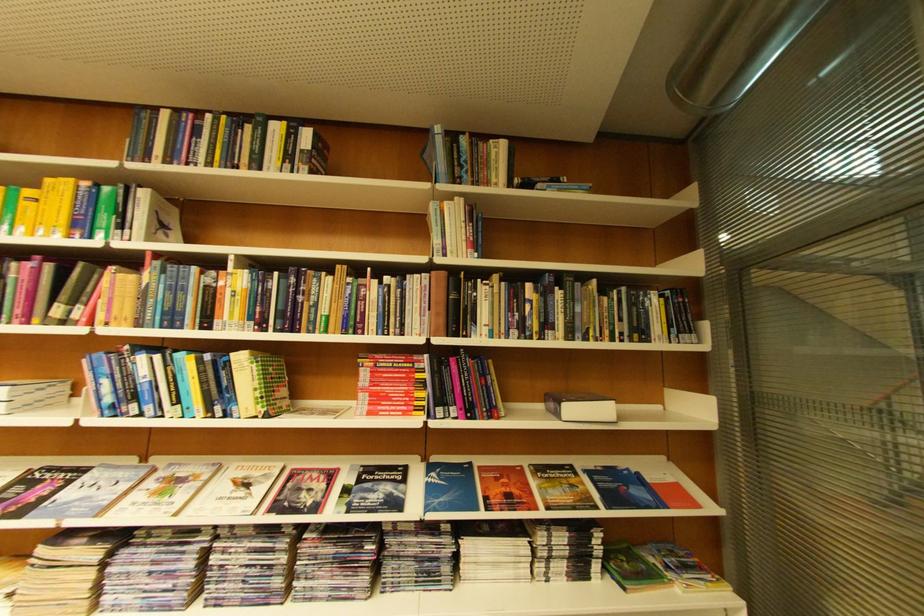
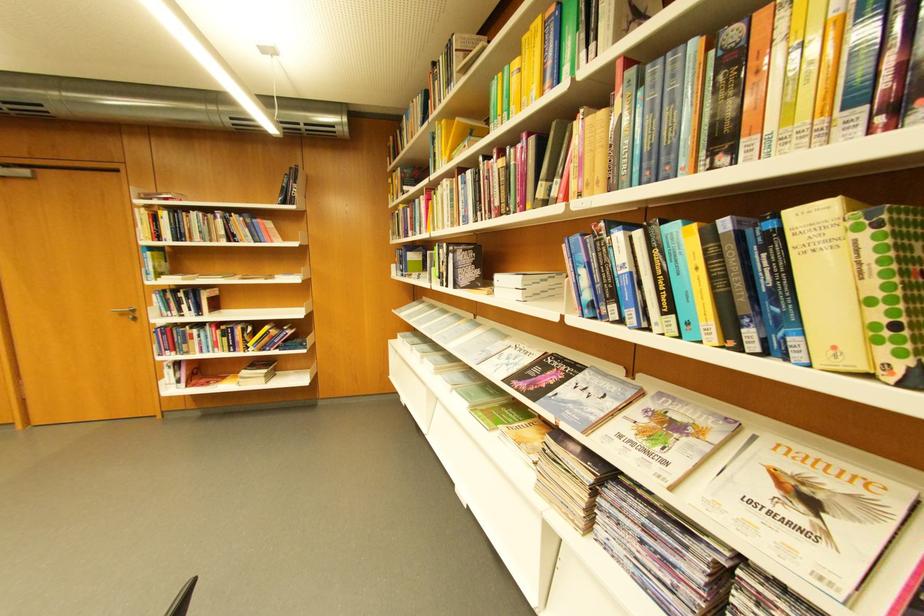
Locate, in the second image, the point that corresponds to [188,403] in the first image.

(681, 310)